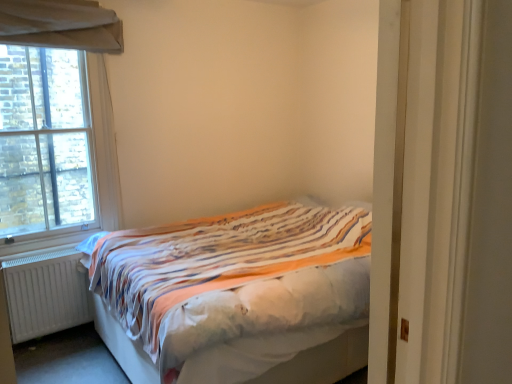
The width and height of the screenshot is (512, 384). What are the coordinates of `white matte radiator at lower left` in the screenshot? It's located at (45, 292).

Describe the element at coordinates (56, 123) in the screenshot. This screenshot has width=512, height=384. I see `brick textured window at left` at that location.

Locate an element on the screen. white matte radiator at lower left is located at coordinates (45, 292).

In the scene shown: Is striped fabric bed at center facing towards brick textured window at left?

No, striped fabric bed at center is not facing towards brick textured window at left.

Who is smaller, striped fabric bed at center or brick textured window at left?

brick textured window at left.

Does point (203, 225) lie behind point (3, 17)?

Yes, point (203, 225) is farther from viewer.

From the image's perspective, which object appears higher, brick textured window at left or striped fabric bed at center?

brick textured window at left, from the image's perspective.

Considering the sizes of brick textured window at left and striped fabric bed at center in the image, is brick textured window at left taller or shorter than striped fabric bed at center?

brick textured window at left is taller than striped fabric bed at center.

Is brick textured window at left positioned beyond the bounds of striped fabric bed at center?

Yes, brick textured window at left is outside of striped fabric bed at center.

Are brick textured window at left and striped fabric bed at center making contact?

There is a gap between brick textured window at left and striped fabric bed at center.

In the scene shown: Considering the sizes of white wooden door at right and white matte radiator at lower left in the image, is white wooden door at right bigger or smaller than white matte radiator at lower left?

In the image, white wooden door at right appears to be larger than white matte radiator at lower left.

Considering their positions, is white wooden door at right located in front of or behind white matte radiator at lower left?

Clearly, white wooden door at right is in front of white matte radiator at lower left.

Is white wooden door at right directly adjacent to white matte radiator at lower left?

white wooden door at right and white matte radiator at lower left are clearly separated.

Would you say white wooden door at right is inside or outside white matte radiator at lower left?

white wooden door at right cannot be found inside white matte radiator at lower left.

Considering the sizes of objects white matte radiator at lower left and white wooden door at right in the image provided, who is bigger, white matte radiator at lower left or white wooden door at right?

With larger size is white wooden door at right.

How many degrees apart are the facing directions of white matte radiator at lower left and white wooden door at right?

They differ by 154 degrees in their facing directions.

Between white matte radiator at lower left and white wooden door at right, which one appears on the right side from the viewer's perspective?

Positioned to the right is white wooden door at right.

Measure the distance between white matte radiator at lower left and white wooden door at right.

The distance of white matte radiator at lower left from white wooden door at right is 2.43 meters.

Is point (76, 125) farther from viewer compared to point (478, 10)?

That is True.

Between brick textured window at left and white wooden door at right, which one has smaller width?

Thinner between the two is brick textured window at left.

I want to click on door on the right of the brick textured window at left, so click(422, 186).

Consider the image. Who is bigger, brick textured window at left or white wooden door at right?

With larger size is white wooden door at right.

Between white wooden door at right and brick textured window at left, which one has less height?

white wooden door at right.

Does white wooden door at right have a larger size compared to brick textured window at left?

Yes.

Are white wooden door at right and brick textured window at left beside each other?

No, white wooden door at right is not beside brick textured window at left.

In the image, is white wooden door at right on the left side or the right side of brick textured window at left?

Clearly, white wooden door at right is on the right of brick textured window at left in the image.

Can you confirm if striped fabric bed at center is shorter than white matte radiator at lower left?

Incorrect, the height of striped fabric bed at center does not fall short of that of white matte radiator at lower left.

From the image's perspective, is striped fabric bed at center above white matte radiator at lower left?

Yes, from the image's perspective, striped fabric bed at center is on top of white matte radiator at lower left.

How much distance is there between striped fabric bed at center and white matte radiator at lower left?

striped fabric bed at center and white matte radiator at lower left are 35.21 inches apart from each other.

Is point (152, 261) closer to viewer compared to point (13, 268)?

Yes, point (152, 261) is in front of point (13, 268).

I want to click on bed below the brick textured window at left (from a real-world perspective), so click(x=234, y=288).

Identify the location of window on the left of the striped fabric bed at center. (56, 123).

When comparing their distances from white matte radiator at lower left, does white wooden door at right or brick textured window at left seem closer?

Based on the image, brick textured window at left appears to be nearer to white matte radiator at lower left.

From the image, which object appears to be farther from white wooden door at right, white matte radiator at lower left or striped fabric bed at center?

The object further to white wooden door at right is white matte radiator at lower left.

Estimate the real-world distances between objects in this image. Which object is closer to brick textured window at left, white wooden door at right or striped fabric bed at center?

striped fabric bed at center lies closer to brick textured window at left than the other object.

Estimate the real-world distances between objects in this image. Which object is further from white wooden door at right, brick textured window at left or white matte radiator at lower left?

Among the two, brick textured window at left is located further to white wooden door at right.

Considering their positions, is brick textured window at left positioned closer to white matte radiator at lower left than striped fabric bed at center?

brick textured window at left.

Estimate the real-world distances between objects in this image. Which object is closer to white wooden door at right, striped fabric bed at center or white matte radiator at lower left?

striped fabric bed at center.

Based on their spatial positions, is striped fabric bed at center or brick textured window at left further from white matte radiator at lower left?

striped fabric bed at center is further to white matte radiator at lower left.

When comparing their distances from striped fabric bed at center, does brick textured window at left or white wooden door at right seem closer?

brick textured window at left is closer to striped fabric bed at center.

Find the location of `window between white matte radiator at lower left and white wooden door at right`. window between white matte radiator at lower left and white wooden door at right is located at coordinates (56, 123).

Where is `bed located between white matte radiator at lower left and white wooden door at right in the left-right direction`? The width and height of the screenshot is (512, 384). bed located between white matte radiator at lower left and white wooden door at right in the left-right direction is located at coordinates (234, 288).

This screenshot has width=512, height=384. I want to click on bed located between brick textured window at left and white wooden door at right in the left-right direction, so click(x=234, y=288).

What are the coordinates of `window located between white matte radiator at lower left and striped fabric bed at center in the left-right direction` in the screenshot? It's located at (56, 123).